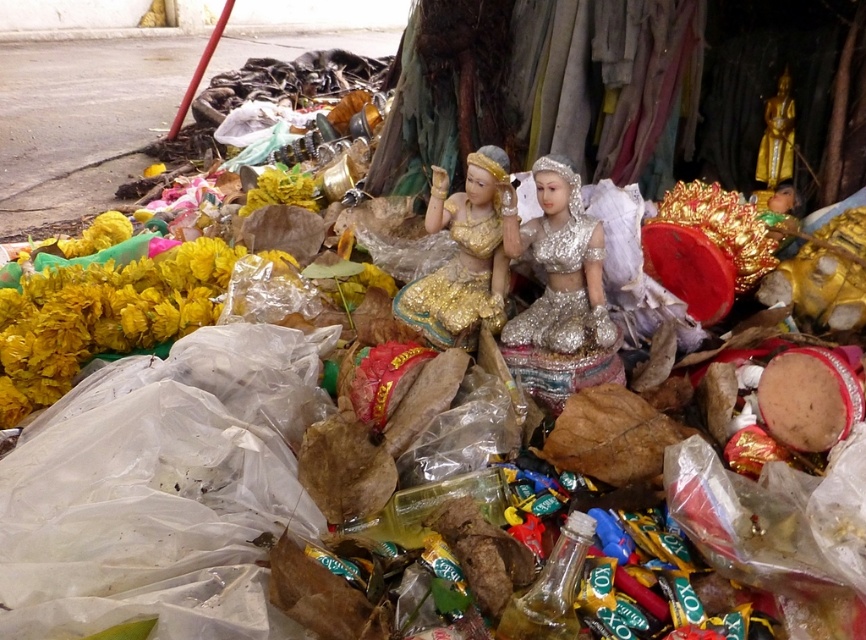
Question: Which is nearer to the yellow fabric flowers at left?

Choices:
 (A) gold metallic doll at center
 (B) yellow fabric flower at center-left
 (C) gold metallic statue at upper right

Answer: (B)

Question: Which of the following is the farthest from the observer?

Choices:
 (A) (599, 333)
 (B) (43, 353)

Answer: (B)

Question: Is yellow fabric flowers at left to the right of gold metallic doll at center from the viewer's perspective?

Choices:
 (A) no
 (B) yes

Answer: (A)

Question: Does gold metallic doll at center appear on the right side of yellow fabric flower at center-left?

Choices:
 (A) no
 (B) yes

Answer: (B)

Question: Can you confirm if silver glittering doll at center is wider than yellow fabric flower at center-left?

Choices:
 (A) yes
 (B) no

Answer: (B)

Question: Which point is closer to the camera?

Choices:
 (A) (481, 296)
 (B) (761, 173)
 (C) (299, 204)
 (D) (107, 268)

Answer: (A)